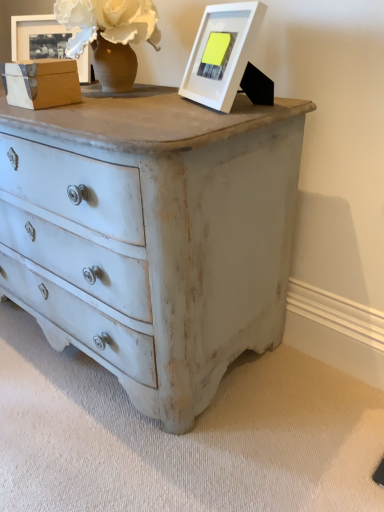
Describe the element at coordinates (221, 53) in the screenshot. I see `white matte picture frame at upper center, positioned as the 2th picture frame in top-to-bottom order` at that location.

The height and width of the screenshot is (512, 384). I want to click on white matte picture frame at upper center, placed as the first picture frame when sorted from front to back, so click(x=221, y=53).

Measure the distance between white matte picture frame at upper center, arranged as the second picture frame when viewed from the left, and camera.

They are 37.83 inches apart.

Identify the location of matte wooden picture frame at upper left, marked as the 1th picture frame in a back-to-front arrangement. [38, 37].

This screenshot has width=384, height=512. Describe the element at coordinates (38, 37) in the screenshot. I see `matte wooden picture frame at upper left, the 2th picture frame in the front-to-back sequence` at that location.

Measure the distance between point (56, 55) and camera.

The distance of point (56, 55) from camera is 1.57 meters.

You are a GUI agent. You are given a task and a screenshot of the screen. Output one action in this format:
    pyautogui.click(x=<x>, y=<y>)
    Task: Click on the white matte picture frame at upper center, placed as the first picture frame when sorted from front to back
    This screenshot has width=384, height=512.
    Given the screenshot: What is the action you would take?
    pyautogui.click(x=221, y=53)

Considering the positions of objects matte wooden picture frame at upper left, the first picture frame positioned from the left, and white matte picture frame at upper center, arranged as the second picture frame when viewed from the left, in the image provided, who is more to the right, matte wooden picture frame at upper left, the first picture frame positioned from the left, or white matte picture frame at upper center, arranged as the second picture frame when viewed from the left,?

white matte picture frame at upper center, arranged as the second picture frame when viewed from the left.

Is matte wooden picture frame at upper left, acting as the 1th picture frame starting from the top, in front of or behind white matte picture frame at upper center, marked as the 2th picture frame in a back-to-front arrangement, in the image?

Clearly, matte wooden picture frame at upper left, acting as the 1th picture frame starting from the top, is behind white matte picture frame at upper center, marked as the 2th picture frame in a back-to-front arrangement.

Is point (53, 32) behind point (213, 101)?

Yes, it is behind point (213, 101).

From the image's perspective, does matte wooden picture frame at upper left, the 2th picture frame in the front-to-back sequence, appear lower than white matte picture frame at upper center, which is the first picture frame in bottom-to-top order?

No.

From a real-world perspective, which is physically below, matte wooden picture frame at upper left, which is the second picture frame from bottom to top, or white matte picture frame at upper center, placed as the first picture frame when sorted from front to back?

In real-world perspective, white matte picture frame at upper center, placed as the first picture frame when sorted from front to back, is lower.

Considering the relative sizes of matte wooden picture frame at upper left, which is counted as the 2th picture frame, starting from the right, and white matte picture frame at upper center, marked as the 2th picture frame in a back-to-front arrangement, in the image provided, is matte wooden picture frame at upper left, which is counted as the 2th picture frame, starting from the right, wider than white matte picture frame at upper center, marked as the 2th picture frame in a back-to-front arrangement,?

No, matte wooden picture frame at upper left, which is counted as the 2th picture frame, starting from the right, is not wider than white matte picture frame at upper center, marked as the 2th picture frame in a back-to-front arrangement.

Is matte wooden picture frame at upper left, which is the second picture frame from bottom to top, shorter than white matte picture frame at upper center, which is the first picture frame in right-to-left order?

Yes.

Does matte wooden picture frame at upper left, acting as the 1th picture frame starting from the top, have a smaller size compared to white matte picture frame at upper center, arranged as the second picture frame when viewed from the left?

Correct, matte wooden picture frame at upper left, acting as the 1th picture frame starting from the top, occupies less space than white matte picture frame at upper center, arranged as the second picture frame when viewed from the left.

Do you think matte wooden picture frame at upper left, acting as the 1th picture frame starting from the top, is within white matte picture frame at upper center, marked as the 2th picture frame in a back-to-front arrangement, or outside of it?

matte wooden picture frame at upper left, acting as the 1th picture frame starting from the top, exists outside the volume of white matte picture frame at upper center, marked as the 2th picture frame in a back-to-front arrangement.

Would you consider matte wooden picture frame at upper left, which is the second picture frame from bottom to top, to be distant from white matte picture frame at upper center, marked as the 2th picture frame in a back-to-front arrangement?

That's not correct — matte wooden picture frame at upper left, which is the second picture frame from bottom to top, is a little close to white matte picture frame at upper center, marked as the 2th picture frame in a back-to-front arrangement.

Could you tell me if matte wooden picture frame at upper left, which is counted as the 2th picture frame, starting from the right, is facing white matte picture frame at upper center, which is the first picture frame in right-to-left order?

No, matte wooden picture frame at upper left, which is counted as the 2th picture frame, starting from the right, is not facing towards white matte picture frame at upper center, which is the first picture frame in right-to-left order.

What's the angular difference between matte wooden picture frame at upper left, which is counted as the 2th picture frame, starting from the right, and white matte picture frame at upper center, which is the first picture frame in bottom-to-top order,'s facing directions?

61.8 degrees separate the facing orientations of matte wooden picture frame at upper left, which is counted as the 2th picture frame, starting from the right, and white matte picture frame at upper center, which is the first picture frame in bottom-to-top order.

Measure the distance from matte wooden picture frame at upper left, the first picture frame positioned from the left, to white matte picture frame at upper center, arranged as the second picture frame when viewed from the left.

The distance of matte wooden picture frame at upper left, the first picture frame positioned from the left, from white matte picture frame at upper center, arranged as the second picture frame when viewed from the left, is 25.99 inches.

Find the location of `picture frame lying in front of the matte wooden picture frame at upper left, acting as the 1th picture frame starting from the top`. picture frame lying in front of the matte wooden picture frame at upper left, acting as the 1th picture frame starting from the top is located at coordinates (221, 53).

Which is more to the left, white matte picture frame at upper center, arranged as the second picture frame when viewed from the left, or matte wooden picture frame at upper left, which is the second picture frame from bottom to top?

matte wooden picture frame at upper left, which is the second picture frame from bottom to top.

Which is behind, white matte picture frame at upper center, positioned as the 2th picture frame in top-to-bottom order, or matte wooden picture frame at upper left, which is the second picture frame from bottom to top?

matte wooden picture frame at upper left, which is the second picture frame from bottom to top, is behind.

Does point (210, 39) come behind point (66, 34)?

No, it is not.

From the image's perspective, is white matte picture frame at upper center, marked as the 2th picture frame in a back-to-front arrangement, beneath matte wooden picture frame at upper left, which is counted as the 2th picture frame, starting from the right?

Indeed, from the image's perspective, white matte picture frame at upper center, marked as the 2th picture frame in a back-to-front arrangement, is shown beneath matte wooden picture frame at upper left, which is counted as the 2th picture frame, starting from the right.

From a real-world perspective, relative to matte wooden picture frame at upper left, marked as the 1th picture frame in a back-to-front arrangement, is white matte picture frame at upper center, positioned as the 2th picture frame in top-to-bottom order, vertically above or below?

Clearly, from a real-world perspective, white matte picture frame at upper center, positioned as the 2th picture frame in top-to-bottom order, is below matte wooden picture frame at upper left, marked as the 1th picture frame in a back-to-front arrangement.

Does white matte picture frame at upper center, placed as the first picture frame when sorted from front to back, have a greater width compared to matte wooden picture frame at upper left, marked as the 1th picture frame in a back-to-front arrangement?

Correct, the width of white matte picture frame at upper center, placed as the first picture frame when sorted from front to back, exceeds that of matte wooden picture frame at upper left, marked as the 1th picture frame in a back-to-front arrangement.

Which of these two, white matte picture frame at upper center, marked as the 2th picture frame in a back-to-front arrangement, or matte wooden picture frame at upper left, acting as the 1th picture frame starting from the top, stands taller?

With more height is white matte picture frame at upper center, marked as the 2th picture frame in a back-to-front arrangement.

Considering the relative sizes of white matte picture frame at upper center, marked as the 2th picture frame in a back-to-front arrangement, and matte wooden picture frame at upper left, the first picture frame positioned from the left, in the image provided, is white matte picture frame at upper center, marked as the 2th picture frame in a back-to-front arrangement, smaller than matte wooden picture frame at upper left, the first picture frame positioned from the left,?

No.

Is white matte picture frame at upper center, positioned as the 2th picture frame in top-to-bottom order, surrounding matte wooden picture frame at upper left, the first picture frame positioned from the left?

No, matte wooden picture frame at upper left, the first picture frame positioned from the left, is located outside of white matte picture frame at upper center, positioned as the 2th picture frame in top-to-bottom order.

Is white matte picture frame at upper center, which is the first picture frame in right-to-left order, next to matte wooden picture frame at upper left, which is the second picture frame from bottom to top, and touching it?

There is a gap between white matte picture frame at upper center, which is the first picture frame in right-to-left order, and matte wooden picture frame at upper left, which is the second picture frame from bottom to top.

Is white matte picture frame at upper center, positioned as the 2th picture frame in top-to-bottom order, oriented towards matte wooden picture frame at upper left, which is the second picture frame from bottom to top?

No, white matte picture frame at upper center, positioned as the 2th picture frame in top-to-bottom order, is not oriented towards matte wooden picture frame at upper left, which is the second picture frame from bottom to top.

This screenshot has width=384, height=512. In the image, there is a white matte picture frame at upper center, which is the first picture frame in bottom-to-top order. Identify the location of picture frame above it (from the image's perspective). (38, 37).

Identify the location of picture frame behind the white matte picture frame at upper center, positioned as the 2th picture frame in top-to-bottom order. This screenshot has width=384, height=512. 38,37.

At what (x,y) coordinates should I click in order to perform the action: click on picture frame that appears in front of the matte wooden picture frame at upper left, the 2th picture frame in the front-to-back sequence. Please return your answer as a coordinate pair (x, y). The width and height of the screenshot is (384, 512). Looking at the image, I should click on (221, 53).